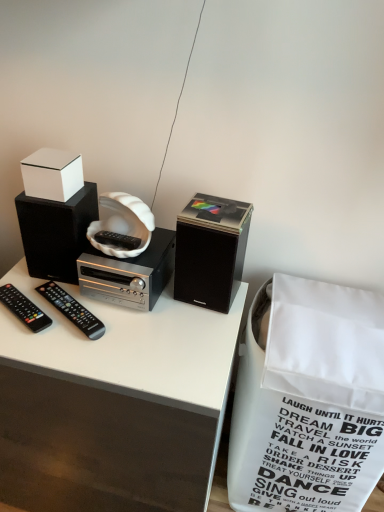
You are a GUI agent. You are given a task and a screenshot of the screen. Output one action in this format:
    pyautogui.click(x=<x>, y=<y>)
    Task: Click on the black plastic remote at left, which ranks as the 1th remote control in left-to-right order
    The width and height of the screenshot is (384, 512).
    Given the screenshot: What is the action you would take?
    pyautogui.click(x=24, y=308)

Locate an element on the screen. The image size is (384, 512). black matte speaker at center, which is the 2th speaker from left to right is located at coordinates (204, 267).

The height and width of the screenshot is (512, 384). What do you see at coordinates (129, 273) in the screenshot? I see `white matte cassette at center` at bounding box center [129, 273].

You are a GUI agent. You are given a task and a screenshot of the screen. Output one action in this format:
    pyautogui.click(x=<x>, y=<y>)
    Task: Click on the white glossy box at upper left
    The height and width of the screenshot is (512, 384).
    Given the screenshot: What is the action you would take?
    pyautogui.click(x=52, y=174)

In order to face black matte speaker at upper left, placed as the 1th speaker when sorted from left to right, should I rotate leftwards or rightwards?

It's best to rotate left around 17.065 degrees.

What do you see at coordinates (56, 232) in the screenshot?
I see `black matte speaker at upper left, placed as the 1th speaker when sorted from left to right` at bounding box center [56, 232].

Find the location of `black plastic remote at lower left, which is counted as the 2th remote control, starting from the left`. black plastic remote at lower left, which is counted as the 2th remote control, starting from the left is located at coordinates (72, 310).

Does point (309, 404) appear closer or farther from the camera than point (74, 320)?

Point (309, 404).

Image resolution: width=384 pixels, height=512 pixels. Find the location of `shopping bag in front of the black plastic remote at lower left, which is counted as the 2th remote control, starting from the left`. shopping bag in front of the black plastic remote at lower left, which is counted as the 2th remote control, starting from the left is located at coordinates (309, 400).

Considering the relative sizes of white paper shopping bag at lower right and black plastic remote at lower left, the 1th remote control viewed from the right, in the image provided, is white paper shopping bag at lower right shorter than black plastic remote at lower left, the 1th remote control viewed from the right,?

No.

Is white paper shopping bag at lower right wider or thinner than black plastic remote at lower left, the 1th remote control viewed from the right?

Considering their sizes, white paper shopping bag at lower right looks broader than black plastic remote at lower left, the 1th remote control viewed from the right.

Based on the photo, is the position of white matte cassette at center more distant than that of black plastic remote at lower left, which is counted as the 2th remote control, starting from the left?

Yes, it is.

Locate an element on the screen. cassette located on the right of black plastic remote at lower left, the 1th remote control viewed from the right is located at coordinates (129, 273).

From the picture: From a real-world perspective, is white matte cassette at center positioned above or below black plastic remote at lower left, the 1th remote control viewed from the right?

white matte cassette at center is above black plastic remote at lower left, the 1th remote control viewed from the right.

Is white matte cassette at center positioned beyond the bounds of black plastic remote at lower left, the 1th remote control viewed from the right?

Absolutely, white matte cassette at center is external to black plastic remote at lower left, the 1th remote control viewed from the right.

I want to click on box above the white paper shopping bag at lower right (from a real-world perspective), so click(52, 174).

Is white paper shopping bag at lower right next to white glossy box at upper left?

white paper shopping bag at lower right and white glossy box at upper left are clearly separated.

From the image's perspective, is white paper shopping bag at lower right beneath white glossy box at upper left?

Yes.

Considering the relative positions of white paper shopping bag at lower right and white glossy box at upper left in the image provided, is white paper shopping bag at lower right to the left of white glossy box at upper left from the viewer's perspective?

No, white paper shopping bag at lower right is not to the left of white glossy box at upper left.

Can we say white glossy box at upper left lies outside white paper shopping bag at lower right?

Yes, white glossy box at upper left is located beyond the bounds of white paper shopping bag at lower right.

Identify the location of shopping bag that appears on the right of white glossy box at upper left. Image resolution: width=384 pixels, height=512 pixels. (309, 400).

Who is taller, white glossy box at upper left or white paper shopping bag at lower right?

white paper shopping bag at lower right.

Looking at this image, considering the sizes of objects white glossy box at upper left and white paper shopping bag at lower right in the image provided, who is wider, white glossy box at upper left or white paper shopping bag at lower right?

Wider between the two is white paper shopping bag at lower right.

Is black matte speaker at center, which is the 2th speaker from left to right, turned away from white matte cassette at center?

No, black matte speaker at center, which is the 2th speaker from left to right,'s orientation is not away from white matte cassette at center.

Which is more to the left, black matte speaker at center, marked as the first speaker in a right-to-left arrangement, or white matte cassette at center?

white matte cassette at center is more to the left.

Which object is wider, black matte speaker at center, marked as the first speaker in a right-to-left arrangement, or white matte cassette at center?

white matte cassette at center is wider.

At what (x,y) coordinates should I click in order to perform the action: click on speaker lying on the right of white matte cassette at center. Please return your answer as a coordinate pair (x, y). The image size is (384, 512). Looking at the image, I should click on (204, 267).

Can you confirm if white matte cassette at center is thinner than black matte speaker at center, marked as the first speaker in a right-to-left arrangement?

No.

Does white matte cassette at center come behind black matte speaker at center, marked as the first speaker in a right-to-left arrangement?

That is True.

Is white paper shopping bag at lower right oriented away from black matte speaker at center, marked as the first speaker in a right-to-left arrangement?

No, white paper shopping bag at lower right's orientation is not away from black matte speaker at center, marked as the first speaker in a right-to-left arrangement.

Considering the relative positions of white paper shopping bag at lower right and black matte speaker at center, which is the 2th speaker from left to right, in the image provided, is white paper shopping bag at lower right to the left or to the right of black matte speaker at center, which is the 2th speaker from left to right,?

white paper shopping bag at lower right is to the right of black matte speaker at center, which is the 2th speaker from left to right.

Which object is thinner, white paper shopping bag at lower right or black matte speaker at center, which is the 2th speaker from left to right?

With smaller width is black matte speaker at center, which is the 2th speaker from left to right.

Which is farther, (x=283, y=483) or (x=226, y=306)?

Positioned behind is point (x=283, y=483).

From the white paper shopping bag at lower right, count 1st remote controls backward and point to it. Please provide its 2D coordinates.

[(72, 310)]

There is a white matte cassette at center. Where is `the 2nd remote control below it (from the image's perspective)`? the 2nd remote control below it (from the image's perspective) is located at coordinates (72, 310).

Considering their positions, is white paper shopping bag at lower right positioned closer to white matte cassette at center than black matte speaker at center, marked as the first speaker in a right-to-left arrangement?

black matte speaker at center, marked as the first speaker in a right-to-left arrangement, is closer to white matte cassette at center.

From the image, which object appears to be nearer to white glossy box at upper left, black plastic remote at left, which ranks as the 1th remote control in left-to-right order, or black matte speaker at upper left, placed as the 1th speaker when sorted from left to right?

black matte speaker at upper left, placed as the 1th speaker when sorted from left to right.

In the scene shown: Considering their positions, is black plastic remote at left, marked as the second remote control in a right-to-left arrangement, positioned further to black matte speaker at center, marked as the first speaker in a right-to-left arrangement, than white matte cassette at center?

black plastic remote at left, marked as the second remote control in a right-to-left arrangement, is positioned further to the anchor black matte speaker at center, marked as the first speaker in a right-to-left arrangement.

Looking at the image, which one is located further to black matte speaker at center, marked as the first speaker in a right-to-left arrangement, black matte speaker at upper left, arranged as the 2th speaker when viewed from the right, or white glossy box at upper left?

Among the two, white glossy box at upper left is located further to black matte speaker at center, marked as the first speaker in a right-to-left arrangement.

Estimate the real-world distances between objects in this image. Which object is further from white paper shopping bag at lower right, black matte speaker at center, marked as the first speaker in a right-to-left arrangement, or black plastic remote at lower left, the 1th remote control viewed from the right?

black plastic remote at lower left, the 1th remote control viewed from the right, lies further to white paper shopping bag at lower right than the other object.

Looking at the image, which one is located further to black matte speaker at center, marked as the first speaker in a right-to-left arrangement, black plastic remote at lower left, which is counted as the 2th remote control, starting from the left, or white glossy box at upper left?

Based on the image, white glossy box at upper left appears to be further to black matte speaker at center, marked as the first speaker in a right-to-left arrangement.

Considering their positions, is black plastic remote at lower left, which is counted as the 2th remote control, starting from the left, positioned further to black matte speaker at upper left, placed as the 1th speaker when sorted from left to right, than black matte speaker at center, marked as the first speaker in a right-to-left arrangement?

black matte speaker at center, marked as the first speaker in a right-to-left arrangement, lies further to black matte speaker at upper left, placed as the 1th speaker when sorted from left to right, than the other object.

Looking at the image, which one is located closer to black plastic remote at left, which ranks as the 1th remote control in left-to-right order, white glossy box at upper left or black matte speaker at center, marked as the first speaker in a right-to-left arrangement?

white glossy box at upper left lies closer to black plastic remote at left, which ranks as the 1th remote control in left-to-right order, than the other object.

You are a GUI agent. You are given a task and a screenshot of the screen. Output one action in this format:
    pyautogui.click(x=<x>, y=<y>)
    Task: Click on the box between black matte speaker at upper left, arranged as the 2th speaker when viewed from the right, and white matte cassette at center
    
    Given the screenshot: What is the action you would take?
    pyautogui.click(x=52, y=174)

The image size is (384, 512). Find the location of `remote control situated between black matte speaker at upper left, arranged as the 2th speaker when viewed from the right, and white paper shopping bag at lower right from left to right`. remote control situated between black matte speaker at upper left, arranged as the 2th speaker when viewed from the right, and white paper shopping bag at lower right from left to right is located at coordinates (72, 310).

Locate an element on the screen. The height and width of the screenshot is (512, 384). remote control between white glossy box at upper left and black plastic remote at lower left, which is counted as the 2th remote control, starting from the left, in the up-down direction is located at coordinates (24, 308).

The width and height of the screenshot is (384, 512). Find the location of `cassette between white glossy box at upper left and black plastic remote at lower left, which is counted as the 2th remote control, starting from the left, from top to bottom`. cassette between white glossy box at upper left and black plastic remote at lower left, which is counted as the 2th remote control, starting from the left, from top to bottom is located at coordinates (129, 273).